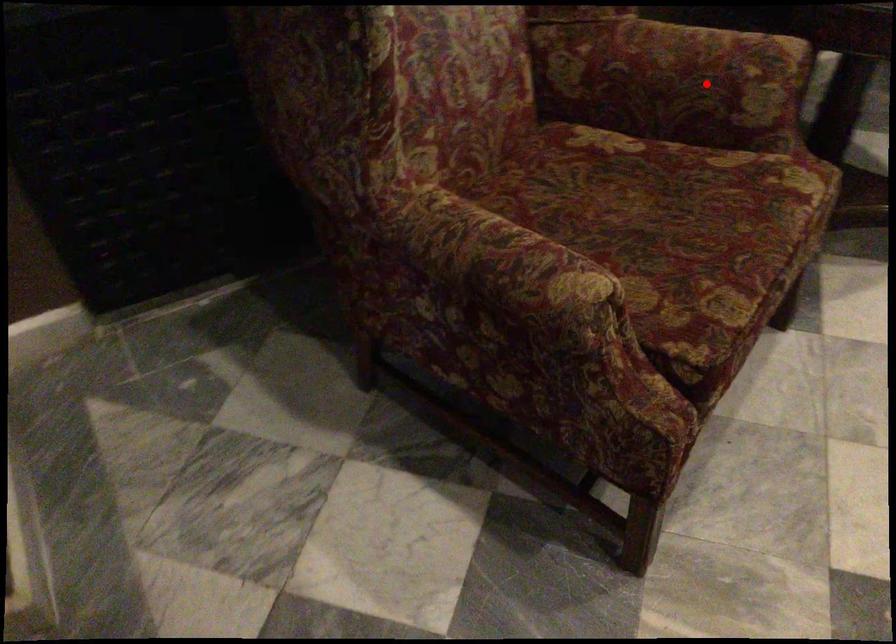
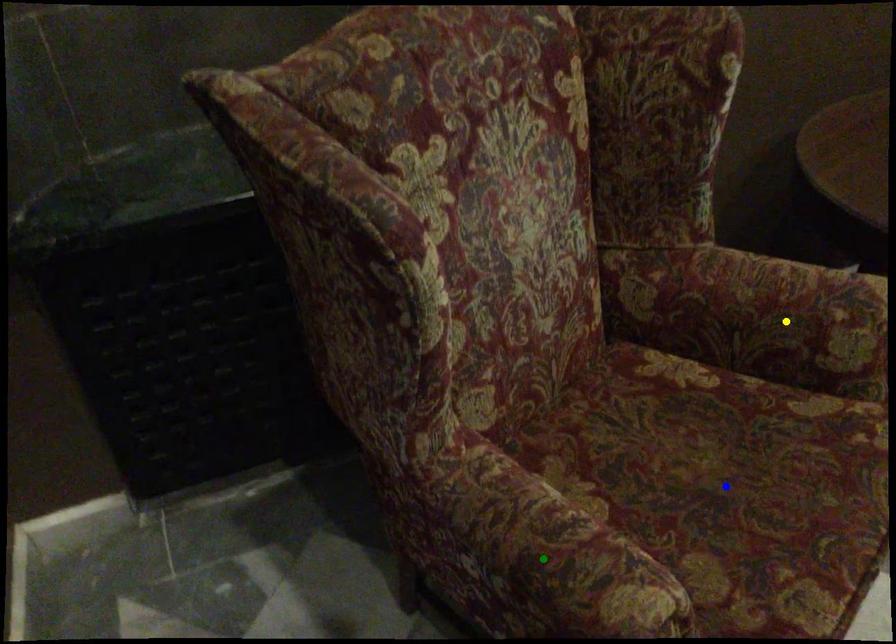
Question: I am providing you with two images of the same scene from different viewpoints. A red point is marked on the first image. You are given multiple points on the second image. In image 2, which mark is for the same physical point as the one in image 1?

Choices:
 (A) green point
 (B) yellow point
 (C) blue point

Answer: (B)